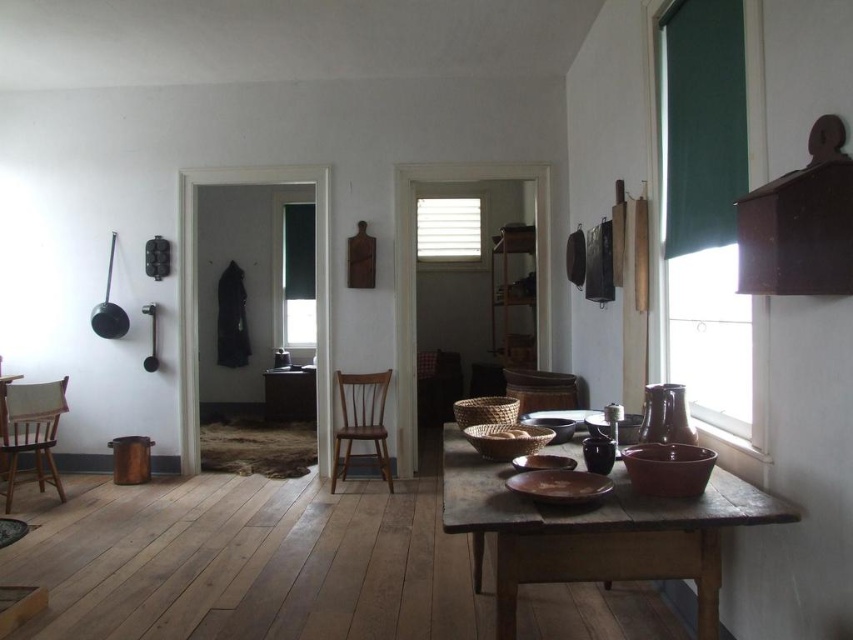
Question: Is wooden chair at lower left thinner than brown wooden chair at center?

Choices:
 (A) no
 (B) yes

Answer: (A)

Question: Considering the real-world distances, which object is farthest from the wooden chair at lower left?

Choices:
 (A) wooden table at center
 (B) green fabric window at right

Answer: (B)

Question: Is green fabric window at right positioned behind brown wooden chair at center?

Choices:
 (A) no
 (B) yes

Answer: (A)

Question: Which point is closer to the camera taking this photo?

Choices:
 (A) (294, 230)
 (B) (361, 436)
 (C) (289, 417)
 (D) (473, 216)

Answer: (B)

Question: Does brown wooden table at lower right appear on the left side of brown wooden chair at center?

Choices:
 (A) yes
 (B) no

Answer: (B)

Question: Which is nearer to the green fabric window at right?

Choices:
 (A) black fabric window at center
 (B) brown wooden table at lower right

Answer: (B)